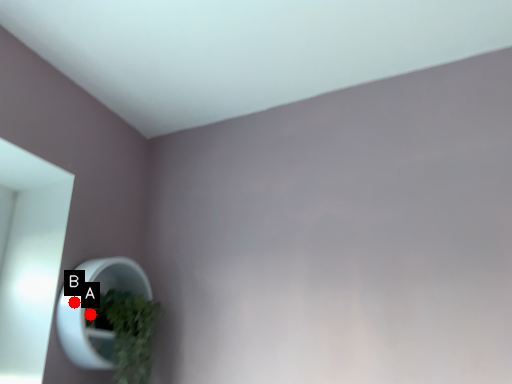
Question: Two points are circled on the image, labeled by A and B beside each circle. Which point is closer to the camera?

Choices:
 (A) A is closer
 (B) B is closer

Answer: (B)